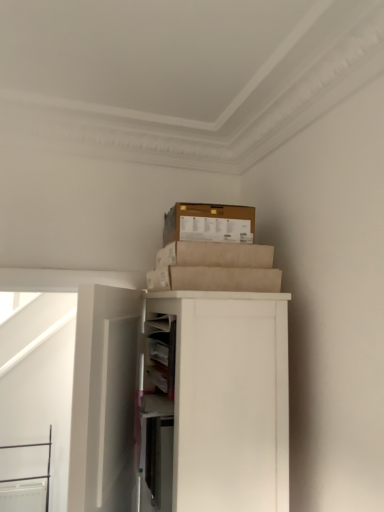
This screenshot has width=384, height=512. What do you see at coordinates (209, 223) in the screenshot? I see `brown cardboard box at upper center` at bounding box center [209, 223].

Identify the location of white matte cabinet at upper right. The image size is (384, 512). (214, 401).

Is white matte door at left next to brown cardboard box at upper center and touching it?

No, white matte door at left is not in contact with brown cardboard box at upper center.

Considering the positions of point (100, 482) and point (243, 208), is point (100, 482) closer or farther from the camera than point (243, 208)?

Clearly, point (100, 482) is closer to the camera than point (243, 208).

This screenshot has width=384, height=512. I want to click on box positioned vertically above the white matte door at left (from a real-world perspective), so click(x=209, y=223).

Is white matte door at left inside or outside of brown cardboard box at upper center?

white matte door at left is spatially situated outside brown cardboard box at upper center.

Which is in front, point (287, 416) or point (94, 351)?

Positioned in front is point (94, 351).

Is white matte cabinet at upper right inside or outside of white matte door at left?

white matte cabinet at upper right is located beyond the bounds of white matte door at left.

Are white matte cabinet at upper right and white matte door at left located far from each other?

No, white matte cabinet at upper right is in close proximity to white matte door at left.

From a real-world perspective, does white matte cabinet at upper right sit lower than white matte door at left?

Actually, white matte cabinet at upper right is physically above white matte door at left in the real world.

Is white matte door at left touching white matte cabinet at upper right?

white matte door at left is not next to white matte cabinet at upper right, and they're not touching.

Which is behind, white matte door at left or white matte cabinet at upper right?

white matte cabinet at upper right is more distant.

Considering the relative positions of white matte door at left and white matte cabinet at upper right in the image provided, is white matte door at left to the left of white matte cabinet at upper right from the viewer's perspective?

Indeed, white matte door at left is positioned on the left side of white matte cabinet at upper right.

Which is less distant, (116, 479) or (163, 487)?

The point (163, 487) is closer to the camera.

From the image's perspective, relative to white matte cabinet at upper right, is brown cardboard box at upper center above or below?

brown cardboard box at upper center is above white matte cabinet at upper right.

Which of these two, brown cardboard box at upper center or white matte cabinet at upper right, stands taller?

With more height is white matte cabinet at upper right.

Is brown cardboard box at upper center turned away from white matte cabinet at upper right?

No, brown cardboard box at upper center's orientation is not away from white matte cabinet at upper right.

From a real-world perspective, does brown cardboard box at upper center stand above white matte door at left?

Yes, from a real-world perspective, brown cardboard box at upper center is above white matte door at left.

The width and height of the screenshot is (384, 512). I want to click on box above the white matte door at left (from a real-world perspective), so click(x=209, y=223).

From the image's perspective, does brown cardboard box at upper center appear lower than white matte door at left?

No, from the image's perspective, brown cardboard box at upper center is not beneath white matte door at left.

From the image's perspective, is white matte cabinet at upper right located beneath brown cardboard box at upper center?

Yes, from the image's perspective, white matte cabinet at upper right is below brown cardboard box at upper center.

Where is `cabinetry below the brown cardboard box at upper center (from the image's perspective)`? The width and height of the screenshot is (384, 512). cabinetry below the brown cardboard box at upper center (from the image's perspective) is located at coordinates (214, 401).

Is white matte cabinet at upper right further to the viewer compared to brown cardboard box at upper center?

No, it is not.

Are white matte cabinet at upper right and brown cardboard box at upper center beside each other?

They are not placed beside each other.

You are a GUI agent. You are given a task and a screenshot of the screen. Output one action in this format:
    pyautogui.click(x=<x>, y=<y>)
    Task: Click on the box above the white matte door at left (from a real-world perspective)
    This screenshot has height=512, width=384.
    Given the screenshot: What is the action you would take?
    pyautogui.click(x=209, y=223)

The height and width of the screenshot is (512, 384). In the image, there is a white matte cabinet at upper right. What are the coordinates of `door below it (from a real-world perspective)` in the screenshot? It's located at (104, 399).

From the picture: Considering their positions, is brown cardboard box at upper center positioned closer to white matte cabinet at upper right than white matte door at left?

white matte door at left lies closer to white matte cabinet at upper right than the other object.

Estimate the real-world distances between objects in this image. Which object is further from brown cardboard box at upper center, white matte cabinet at upper right or white matte door at left?

white matte door at left lies further to brown cardboard box at upper center than the other object.

Based on their spatial positions, is white matte door at left or brown cardboard box at upper center further from white matte cabinet at upper right?

brown cardboard box at upper center.

Based on their spatial positions, is white matte cabinet at upper right or brown cardboard box at upper center further from white matte door at left?

Among the two, brown cardboard box at upper center is located further to white matte door at left.

Estimate the real-world distances between objects in this image. Which object is closer to white matte door at left, brown cardboard box at upper center or white matte cabinet at upper right?

white matte cabinet at upper right is positioned closer to the anchor white matte door at left.

When comparing their distances from brown cardboard box at upper center, does white matte door at left or white matte cabinet at upper right seem closer?

The object closer to brown cardboard box at upper center is white matte cabinet at upper right.

You are a GUI agent. You are given a task and a screenshot of the screen. Output one action in this format:
    pyautogui.click(x=<x>, y=<y>)
    Task: Click on the cabinetry that lies between brown cardboard box at upper center and white matte door at left from top to bottom
    Image resolution: width=384 pixels, height=512 pixels.
    Given the screenshot: What is the action you would take?
    pyautogui.click(x=214, y=401)